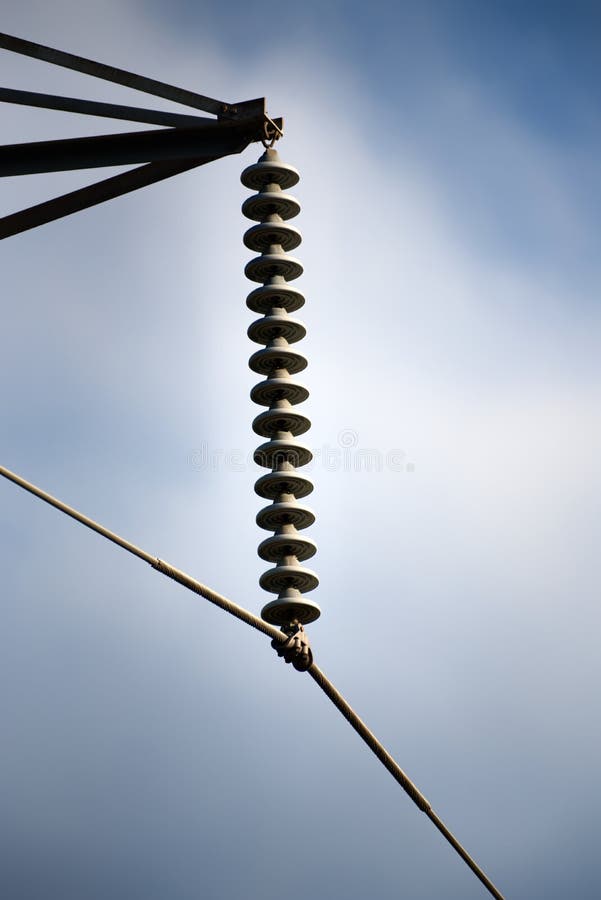
At what (x,y) coordinates should I click in order to perform the action: click on cable. Please return your answer as a coordinate pair (x, y). The height and width of the screenshot is (900, 601). Looking at the image, I should click on (224, 598).